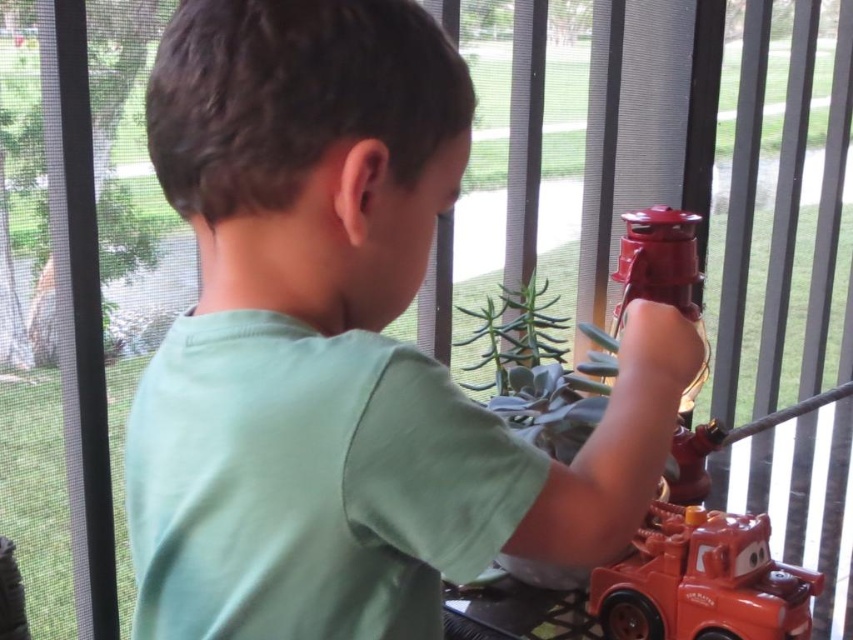
Question: Observing the image, what is the correct spatial positioning of green matte shirt at center in reference to shiny orange plastic toy car at lower right?

Choices:
 (A) left
 (B) right

Answer: (A)

Question: Which point is closer to the camera?

Choices:
 (A) (718, 524)
 (B) (293, 308)

Answer: (B)

Question: Is green matte shirt at center wider than shiny orange plastic toy car at lower right?

Choices:
 (A) yes
 (B) no

Answer: (A)

Question: Which object appears farthest from the camera in this image?

Choices:
 (A) green matte shirt at center
 (B) shiny orange plastic toy car at lower right

Answer: (B)

Question: Is green matte shirt at center smaller than shiny orange plastic toy car at lower right?

Choices:
 (A) yes
 (B) no

Answer: (B)